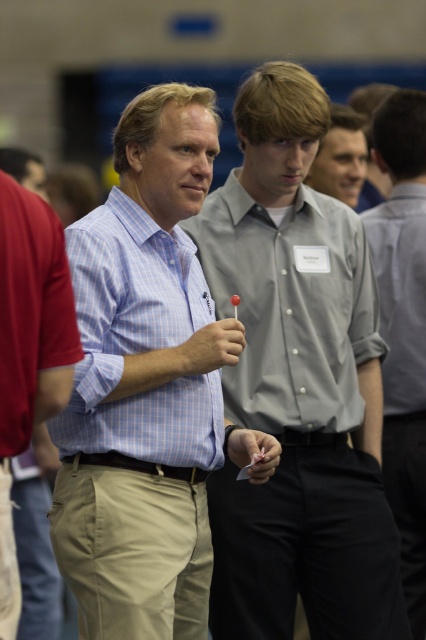
Question: Is gray button-down shirt at center to the left of light blue checkered shirt at center from the viewer's perspective?

Choices:
 (A) no
 (B) yes

Answer: (A)

Question: Which point is closer to the camera?

Choices:
 (A) khaki pants at center
 (B) light blue checkered shirt at center
 (C) gray shirt at center

Answer: (A)

Question: Does matte gray shirt at center lie behind light blue checkered shirt at center?

Choices:
 (A) no
 (B) yes

Answer: (B)

Question: Among these objects, which one is farthest from the camera?

Choices:
 (A) gray shirt at center
 (B) light blue checkered shirt at center
 (C) gray button-down shirt at center
 (D) gray cotton shirt at center

Answer: (A)

Question: Which of the following is the farthest from the observer?

Choices:
 (A) (405, 301)
 (B) (273, 412)
 (C) (264, 477)
 (D) (342, 168)

Answer: (D)

Question: Does matte gray shirt at center come behind light blue checkered shirt at center?

Choices:
 (A) no
 (B) yes

Answer: (B)